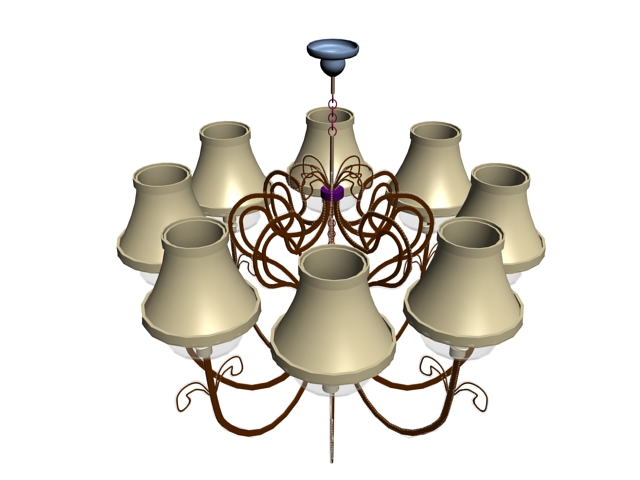
Locate an element on the screen. The image size is (640, 480). top inside of shades is located at coordinates (329, 262), (470, 236), (186, 239), (493, 168), (445, 133), (208, 129), (157, 171).